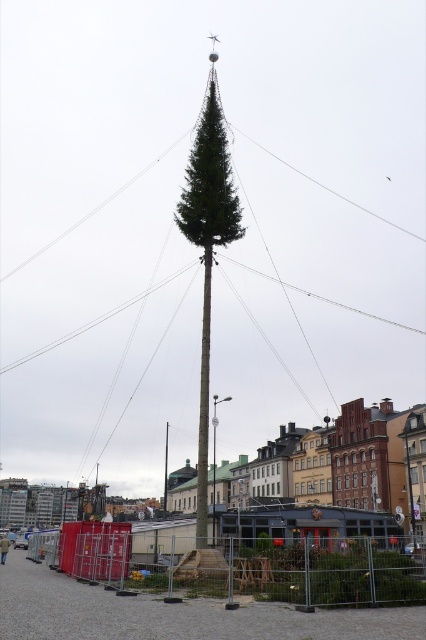
Question: Which point is closer to the camera?

Choices:
 (A) green matte pole at center
 (B) green matte tree at center

Answer: (B)

Question: Which of the following is the farthest from the observer?

Choices:
 (A) green matte tree at center
 (B) green matte pole at center

Answer: (B)

Question: Can you confirm if green matte tree at center is positioned below green matte pole at center?

Choices:
 (A) no
 (B) yes

Answer: (A)

Question: Which point is closer to the camera taking this photo?

Choices:
 (A) (164, 502)
 (B) (244, 228)

Answer: (B)

Question: Can you confirm if green matte tree at center is smaller than green matte pole at center?

Choices:
 (A) yes
 (B) no

Answer: (B)

Question: Does green matte tree at center have a greater width compared to green matte pole at center?

Choices:
 (A) no
 (B) yes

Answer: (A)